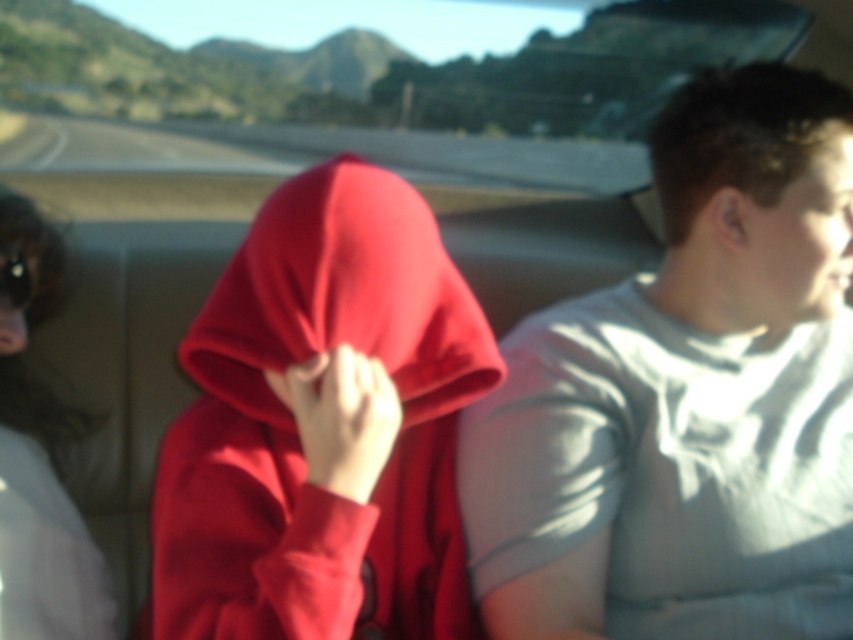
Which of these two, matte red hoodie at center or matte black goggles at upper left, stands taller?

matte red hoodie at center is taller.

Does point (184, 580) come behind point (18, 289)?

That is False.

Who is more forward, (202,548) or (16,292)?

Positioned in front is point (202,548).

Locate an element on the screen. matte red hoodie at center is located at coordinates (297, 433).

Between sunglasses at left and matte black goggles at upper left, which one has more height?

sunglasses at left

Who is positioned more to the left, sunglasses at left or matte black goggles at upper left?

matte black goggles at upper left

Identify the location of sunglasses at left. coord(39,467).

Which is below, light gray cotton t-shirt at right or matte black goggles at upper left?

Positioned lower is light gray cotton t-shirt at right.

Is point (842, 88) closer to camera compared to point (0, 276)?

Yes, it is.

The width and height of the screenshot is (853, 640). What do you see at coordinates (688, 397) in the screenshot?
I see `light gray cotton t-shirt at right` at bounding box center [688, 397].

Locate an element on the screen. This screenshot has height=640, width=853. light gray cotton t-shirt at right is located at coordinates (688, 397).